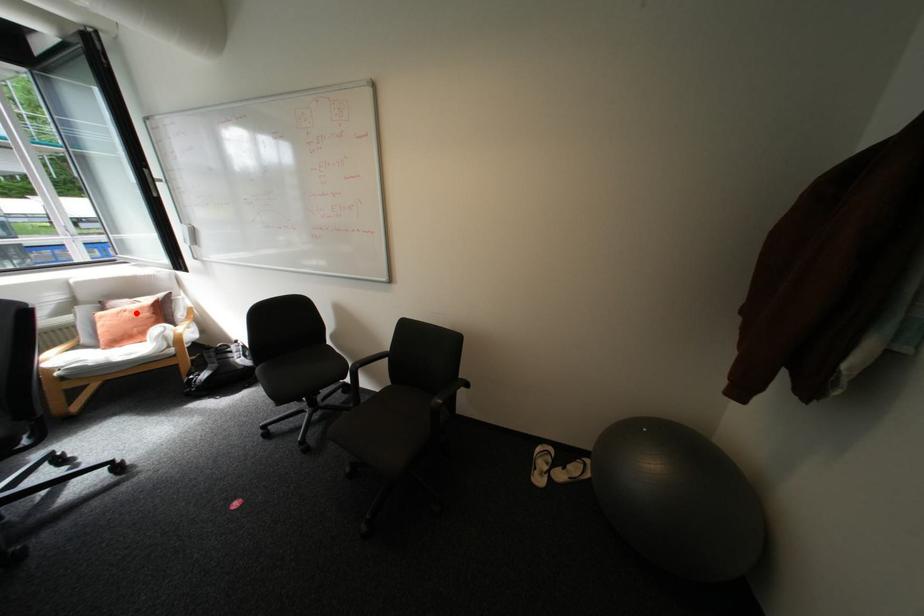
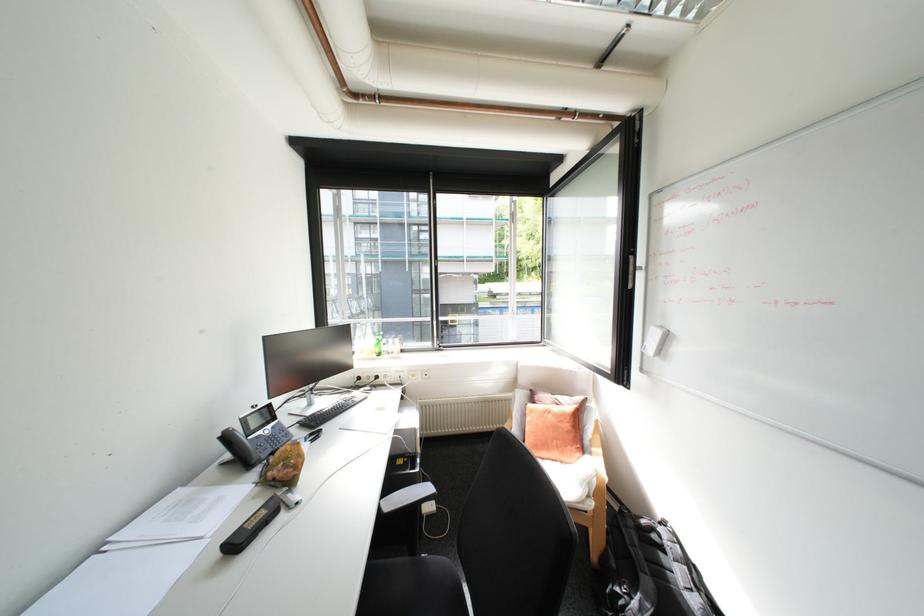
Where in the second image is the point corresponding to the highlighted location from the first image?

(561, 416)